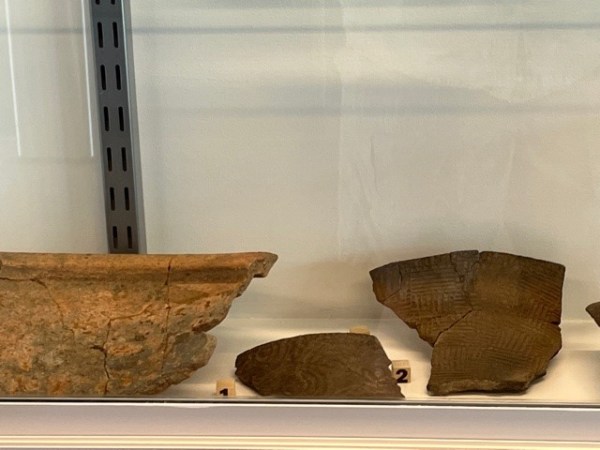
The image size is (600, 450). What are the coordinates of `pot` in the screenshot? It's located at (319, 343).